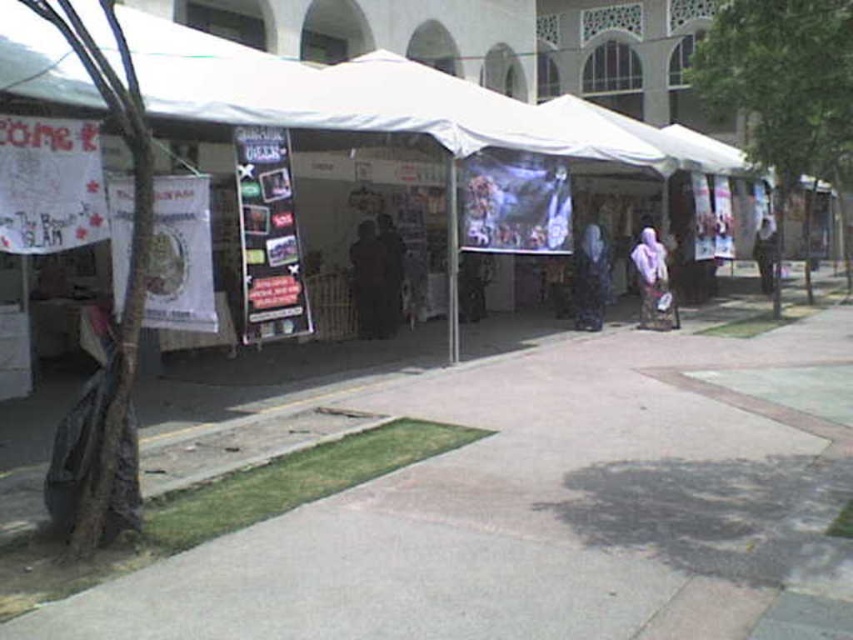
Which is behind, point (341, 536) or point (291, 104)?

The point (291, 104) is more distant.

Describe the element at coordinates (549, 508) in the screenshot. I see `concrete at center` at that location.

Consider the image. Measure the distance between concrete at center and camera.

They are 3.44 meters apart.

Image resolution: width=853 pixels, height=640 pixels. I want to click on concrete at center, so click(x=549, y=508).

Between purple fabric at center and light purple fabric at center, which one is positioned lower?

purple fabric at center is lower down.

Who is higher up, purple fabric at center or light purple fabric at center?

light purple fabric at center is above.

Who is more distant from viewer, (651, 278) or (772, 262)?

Point (772, 262)

I want to click on purple fabric at center, so click(653, 284).

Can you confirm if concrete at center is positioned above purple fabric at center?

No, concrete at center is not above purple fabric at center.

Is concrete at center to the left of purple fabric at center from the viewer's perspective?

Yes, concrete at center is to the left of purple fabric at center.

Is point (708, 352) positioned after point (660, 259)?

No, it is not.

You are a GUI agent. You are given a task and a screenshot of the screen. Output one action in this format:
    pyautogui.click(x=<x>, y=<y>)
    Task: Click on the concrete at center
    
    Given the screenshot: What is the action you would take?
    pyautogui.click(x=549, y=508)